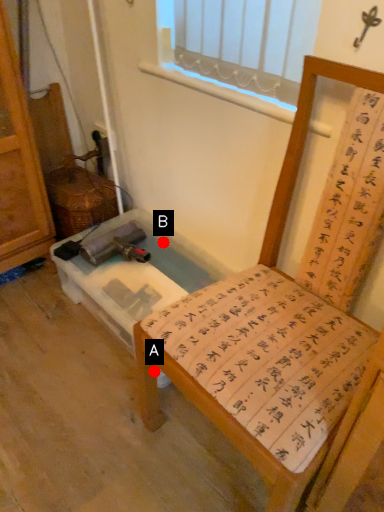
Question: Two points are circled on the image, labeled by A and B beside each circle. Which point is closer to the camera?

Choices:
 (A) A is closer
 (B) B is closer

Answer: (A)